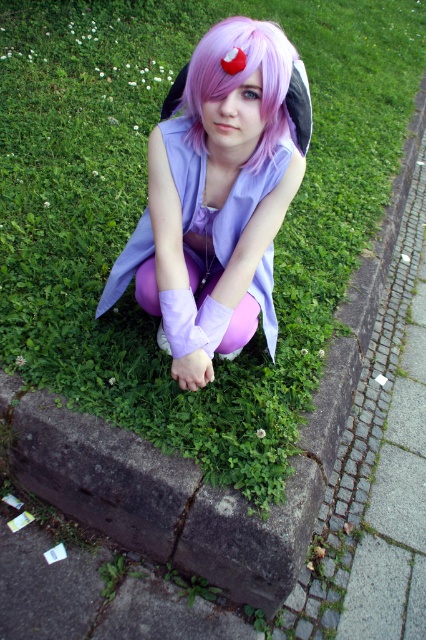
You are a photographer trying to capture the perfect shot of the cosplay character. You notice two points in the scene marked as point 1 at coordinates point (271, 220) and point 2 at coordinates point (244, 65). If you want to position yourself so that point 1 is visible but point 2 is hidden behind an obstacle, which point should you place an obstacle in front of?

You should place the obstacle in front of point 2 at coordinates point (244, 65). Since point 1 at coordinates point (271, 220) is behind point 2, placing an obstacle in front of point 2 will block the view of point 2 while keeping point 1 visible.

You are a photographer trying to capture the cosplay character in the image. The lavender fabric dress at center is at point (216, 198). Where should you position your camera to ensure the dress is centered in your shot?

To center the lavender fabric dress at center at point (216, 198) in the shot, position the camera directly facing the coordinates provided so the dress aligns with the center of the frame.

You are a photographer setting up a shoot in a park. You notice a person in cosplay attire crouching on a grassy patch with a stone curb. The cosplay includes a lavender fabric dress at center and a purple matte wig at center. To ensure proper lighting, you need to know the vertical positioning of these items. Which object is positioned lower in the image?

The lavender fabric dress at center is located below the purple matte wig at center, so it is positioned lower in the image.